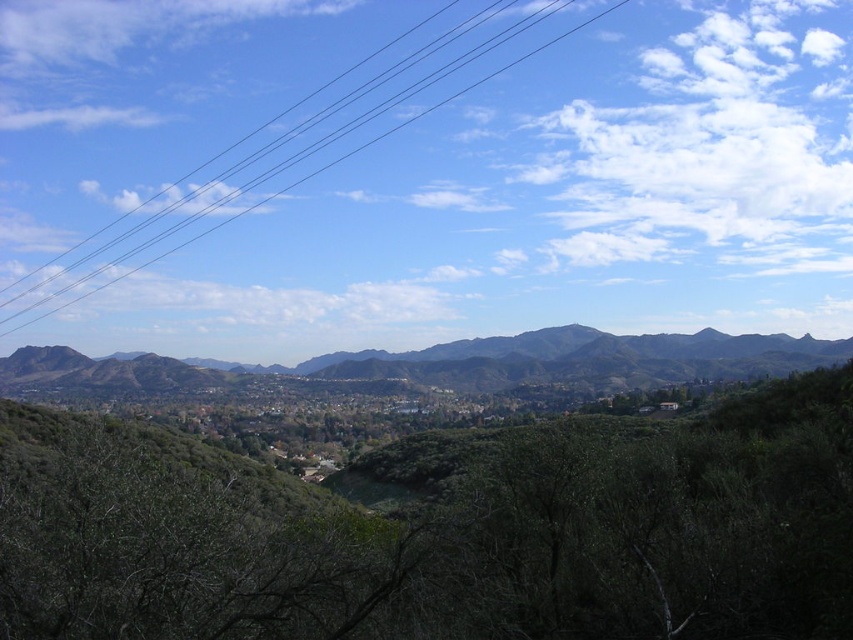
Question: Can you confirm if green leafy tree at center is positioned to the right of green textured mountain at center?

Choices:
 (A) no
 (B) yes

Answer: (B)

Question: Is green textured mountain at center above black wire at upper center?

Choices:
 (A) yes
 (B) no

Answer: (B)

Question: Which object is closer to the camera taking this photo?

Choices:
 (A) green textured mountain at center
 (B) black wire at upper center

Answer: (A)

Question: Observing the image, what is the correct spatial positioning of green textured mountain at center in reference to black wire at upper center?

Choices:
 (A) above
 (B) below

Answer: (B)

Question: Which object appears farthest from the camera in this image?

Choices:
 (A) green textured mountain at center
 (B) black wire at upper center

Answer: (B)

Question: Which point is farther to the camera?

Choices:
 (A) (682, 493)
 (B) (579, 326)

Answer: (B)